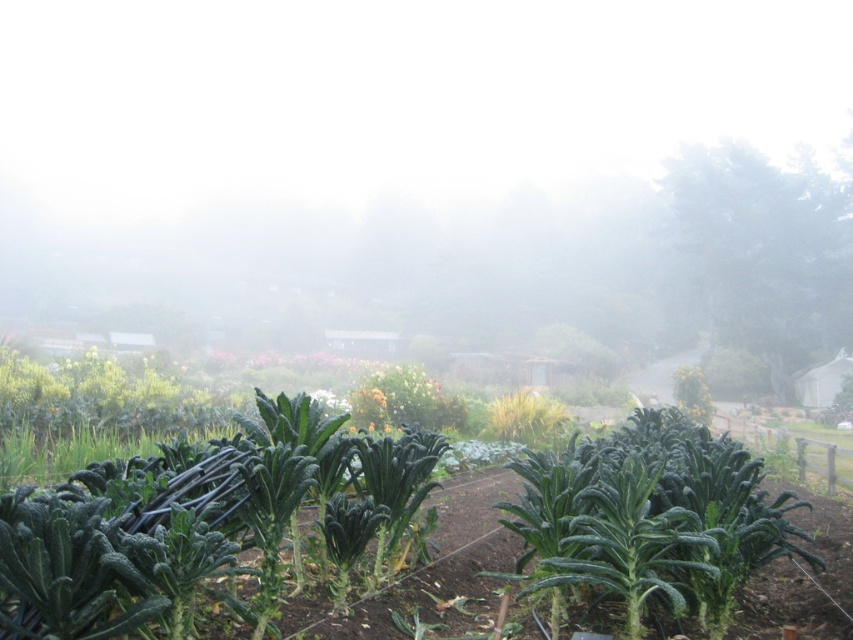
Question: Can you confirm if white misty fog at upper center is positioned to the right of green leafy vegetables at center?

Choices:
 (A) no
 (B) yes

Answer: (B)

Question: In this image, where is white misty fog at upper center located relative to green leafy vegetables at center?

Choices:
 (A) below
 (B) above

Answer: (B)

Question: Can you confirm if white misty fog at upper center is bigger than green leafy vegetables at center?

Choices:
 (A) no
 (B) yes

Answer: (B)

Question: Among these objects, which one is farthest from the camera?

Choices:
 (A) green leafy vegetables at center
 (B) white misty fog at upper center

Answer: (B)

Question: Which object appears closest to the camera in this image?

Choices:
 (A) green leafy vegetables at center
 (B) white misty fog at upper center

Answer: (A)

Question: Which object is farther from the camera taking this photo?

Choices:
 (A) green leafy vegetables at center
 (B) white misty fog at upper center

Answer: (B)